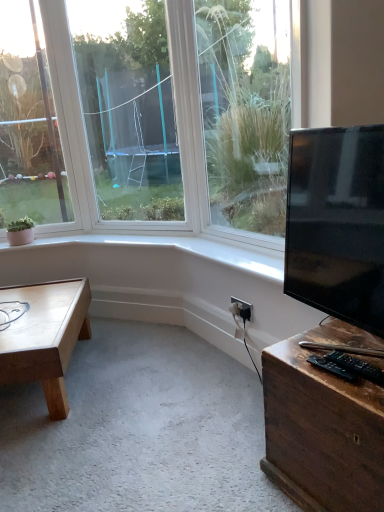
Question: Is black glossy tv at right positioned beyond the bounds of black plastic remote control at lower right, the 2th wide viewed from the right?

Choices:
 (A) yes
 (B) no

Answer: (A)

Question: Is black glossy tv at right oriented away from black plastic remote control at lower right, the 2th wide viewed from the right?

Choices:
 (A) yes
 (B) no

Answer: (B)

Question: Is black glossy tv at right oriented towards black plastic remote control at lower right, the 2th wide viewed from the right?

Choices:
 (A) yes
 (B) no

Answer: (A)

Question: Can you confirm if black glossy tv at right is bigger than black plastic remote control at lower right, the 2th wide viewed from the right?

Choices:
 (A) no
 (B) yes

Answer: (B)

Question: Is black plastic remote control at lower right, the 2th wide viewed from the right, located within black glossy tv at right?

Choices:
 (A) no
 (B) yes

Answer: (A)

Question: Can you confirm if black glossy tv at right is positioned to the right of black plastic remote control at lower right, which is counted as the first wide, starting from the left?

Choices:
 (A) yes
 (B) no

Answer: (A)

Question: Is wooden desk at lower right behind black plastic remote control at lower right, positioned as the 2th wide in left-to-right order?

Choices:
 (A) yes
 (B) no

Answer: (B)

Question: Can you confirm if wooden desk at lower right is thinner than black plastic remote control at lower right, placed as the first wide when sorted from right to left?

Choices:
 (A) no
 (B) yes

Answer: (A)

Question: Is wooden desk at lower right at the left side of black plastic remote control at lower right, placed as the first wide when sorted from right to left?

Choices:
 (A) no
 (B) yes

Answer: (A)

Question: Does wooden desk at lower right appear on the right side of black plastic remote control at lower right, placed as the first wide when sorted from right to left?

Choices:
 (A) no
 (B) yes

Answer: (B)

Question: Is wooden desk at lower right surrounding black plastic remote control at lower right, placed as the first wide when sorted from right to left?

Choices:
 (A) yes
 (B) no

Answer: (B)

Question: From the image's perspective, is wooden desk at lower right beneath black plastic remote control at lower right, positioned as the 2th wide in left-to-right order?

Choices:
 (A) yes
 (B) no

Answer: (A)

Question: Is black plastic remote control at lower right, placed as the first wide when sorted from right to left, at the left side of black plastic remote control at lower right, the 2th wide viewed from the right?

Choices:
 (A) yes
 (B) no

Answer: (B)